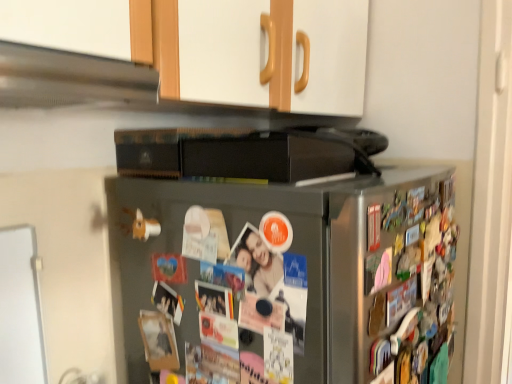
Question: Does satin silver refrigerator at center contain satin silver exhaust hood at upper left?

Choices:
 (A) no
 (B) yes

Answer: (A)

Question: From a real-world perspective, is satin silver refrigerator at center positioned under satin silver exhaust hood at upper left based on gravity?

Choices:
 (A) yes
 (B) no

Answer: (A)

Question: Considering the relative sizes of satin silver refrigerator at center and satin silver exhaust hood at upper left in the image provided, is satin silver refrigerator at center bigger than satin silver exhaust hood at upper left?

Choices:
 (A) no
 (B) yes

Answer: (B)

Question: Is satin silver refrigerator at center aimed at satin silver exhaust hood at upper left?

Choices:
 (A) yes
 (B) no

Answer: (B)

Question: From a real-world perspective, is satin silver refrigerator at center located higher than satin silver exhaust hood at upper left?

Choices:
 (A) yes
 (B) no

Answer: (B)

Question: Is satin silver refrigerator at center turned away from satin silver exhaust hood at upper left?

Choices:
 (A) yes
 (B) no

Answer: (B)

Question: From a real-world perspective, is satin silver exhaust hood at upper left beneath satin silver refrigerator at center?

Choices:
 (A) no
 (B) yes

Answer: (A)

Question: Considering the relative sizes of satin silver exhaust hood at upper left and satin silver refrigerator at center in the image provided, is satin silver exhaust hood at upper left taller than satin silver refrigerator at center?

Choices:
 (A) no
 (B) yes

Answer: (A)

Question: Is satin silver exhaust hood at upper left smaller than satin silver refrigerator at center?

Choices:
 (A) yes
 (B) no

Answer: (A)

Question: Is the position of satin silver exhaust hood at upper left more distant than that of satin silver refrigerator at center?

Choices:
 (A) no
 (B) yes

Answer: (A)

Question: Considering the relative sizes of satin silver exhaust hood at upper left and satin silver refrigerator at center in the image provided, is satin silver exhaust hood at upper left shorter than satin silver refrigerator at center?

Choices:
 (A) yes
 (B) no

Answer: (A)

Question: From the image's perspective, does satin silver exhaust hood at upper left appear lower than satin silver refrigerator at center?

Choices:
 (A) no
 (B) yes

Answer: (A)

Question: In terms of width, does satin silver refrigerator at center look wider or thinner when compared to satin silver exhaust hood at upper left?

Choices:
 (A) thin
 (B) wide

Answer: (B)